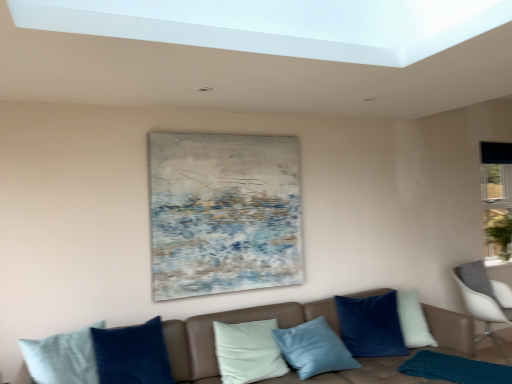
Question: In the image, is teal knitted mat at lower right positioned in front of or behind white glossy window sill at lower right?

Choices:
 (A) behind
 (B) front

Answer: (B)

Question: Looking at their shapes, would you say teal knitted mat at lower right is wider or thinner than white glossy window sill at lower right?

Choices:
 (A) thin
 (B) wide

Answer: (B)

Question: Which object is the closest to the white plastic chair at right?

Choices:
 (A) velvet blue pillow at center
 (B) brown leather couch at lower center
 (C) white glossy window sill at lower right
 (D) teal knitted mat at lower right
 (E) textured canvas painting at upper center

Answer: (C)

Question: Which object is the closest to the brown leather couch at lower center?

Choices:
 (A) white glossy window sill at lower right
 (B) velvet blue pillow at center
 (C) white plastic chair at right
 (D) textured canvas painting at upper center
 (E) teal knitted mat at lower right

Answer: (B)